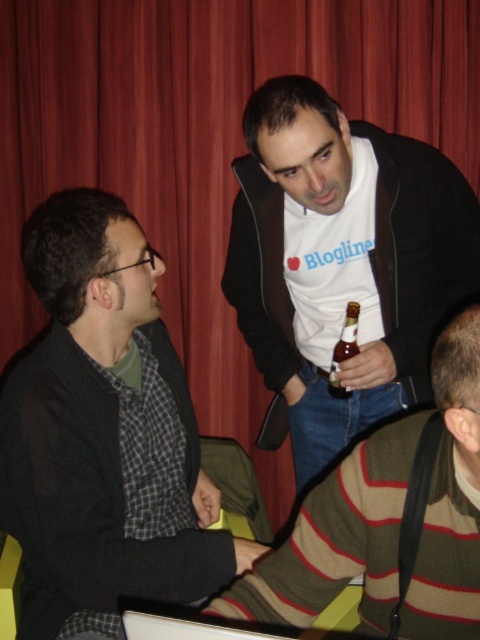
Question: Can you confirm if white matte shirt at center is wider than brown glass bottle at center?

Choices:
 (A) no
 (B) yes

Answer: (B)

Question: Which of the following is the farthest from the observer?

Choices:
 (A) brown glass bottle at center
 (B) striped wool sweater at lower right
 (C) white matte shirt at center

Answer: (A)

Question: Does black matte jacket at left come behind striped wool sweater at lower right?

Choices:
 (A) no
 (B) yes

Answer: (B)

Question: Which point is farther to the camera?

Choices:
 (A) (418, 332)
 (B) (48, 448)
 (C) (348, 333)
 (D) (368, 452)

Answer: (A)

Question: Which object appears farthest from the camera in this image?

Choices:
 (A) white matte shirt at center
 (B) black matte jacket at left
 (C) brown glass bottle at center

Answer: (C)

Question: Observing the image, what is the correct spatial positioning of black matte jacket at left in reference to brown glass bottle at center?

Choices:
 (A) below
 (B) above

Answer: (A)